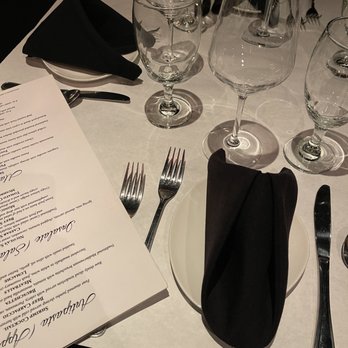
Locate an element on the screen. stem of glasses is located at coordinates (167, 98), (240, 109), (314, 134), (270, 7).